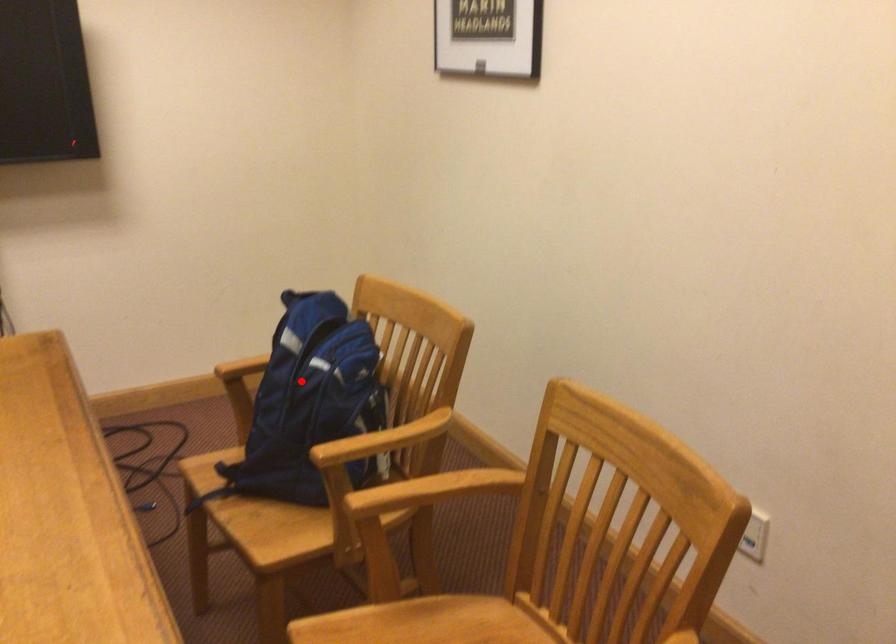
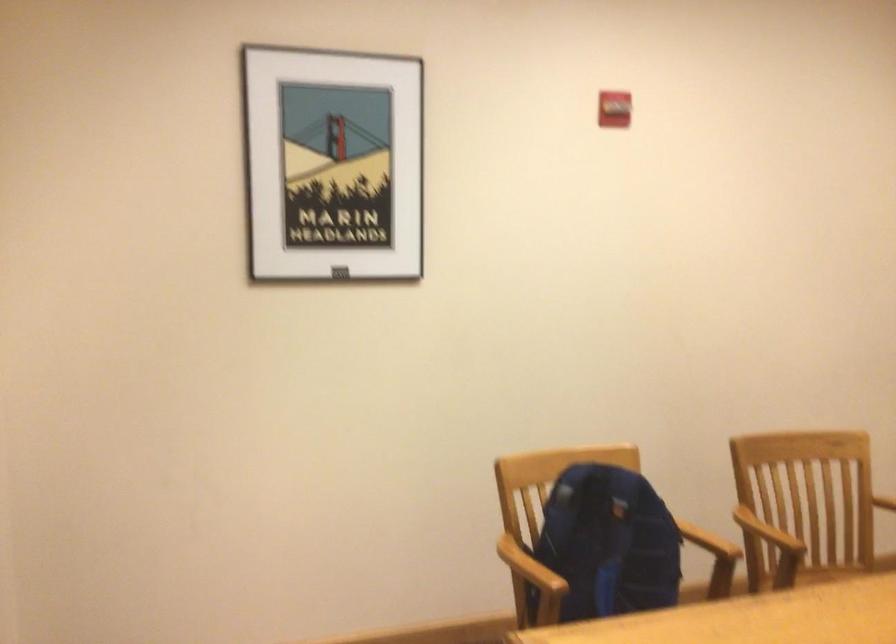
Find the pixel in the second image that matches the highlighted location in the first image.

(607, 544)